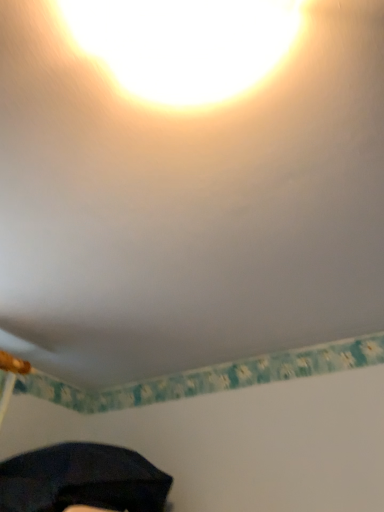
Question: Is matte yellow light at upper center surrounding dark matte umbrella at lower left?

Choices:
 (A) yes
 (B) no

Answer: (B)

Question: Does matte yellow light at upper center come in front of dark matte umbrella at lower left?

Choices:
 (A) yes
 (B) no

Answer: (A)

Question: Is matte yellow light at upper center positioned behind dark matte umbrella at lower left?

Choices:
 (A) yes
 (B) no

Answer: (B)

Question: Can you confirm if matte yellow light at upper center is positioned to the left of dark matte umbrella at lower left?

Choices:
 (A) yes
 (B) no

Answer: (B)

Question: Is matte yellow light at upper center smaller than dark matte umbrella at lower left?

Choices:
 (A) yes
 (B) no

Answer: (A)

Question: From a real-world perspective, is matte yellow light at upper center located higher than dark matte umbrella at lower left?

Choices:
 (A) no
 (B) yes

Answer: (B)

Question: Is dark matte umbrella at lower left outside of matte yellow light at upper center?

Choices:
 (A) no
 (B) yes

Answer: (B)

Question: Does dark matte umbrella at lower left have a smaller size compared to matte yellow light at upper center?

Choices:
 (A) yes
 (B) no

Answer: (B)

Question: Does dark matte umbrella at lower left have a lesser height compared to matte yellow light at upper center?

Choices:
 (A) no
 (B) yes

Answer: (A)

Question: Considering the relative positions of dark matte umbrella at lower left and matte yellow light at upper center in the image provided, is dark matte umbrella at lower left to the left of matte yellow light at upper center from the viewer's perspective?

Choices:
 (A) yes
 (B) no

Answer: (A)

Question: Is dark matte umbrella at lower left positioned behind matte yellow light at upper center?

Choices:
 (A) no
 (B) yes

Answer: (B)

Question: Is dark matte umbrella at lower left closer to the viewer compared to matte yellow light at upper center?

Choices:
 (A) yes
 (B) no

Answer: (B)

Question: Looking at the image, does dark matte umbrella at lower left seem bigger or smaller compared to matte yellow light at upper center?

Choices:
 (A) small
 (B) big

Answer: (B)